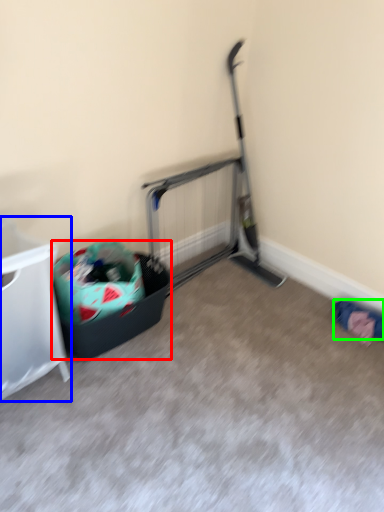
Question: Which is nearer to the recycling bin (highlighted by a red box)? furniture (highlighted by a blue box) or clothing (highlighted by a green box).

Choices:
 (A) furniture
 (B) clothing

Answer: (A)